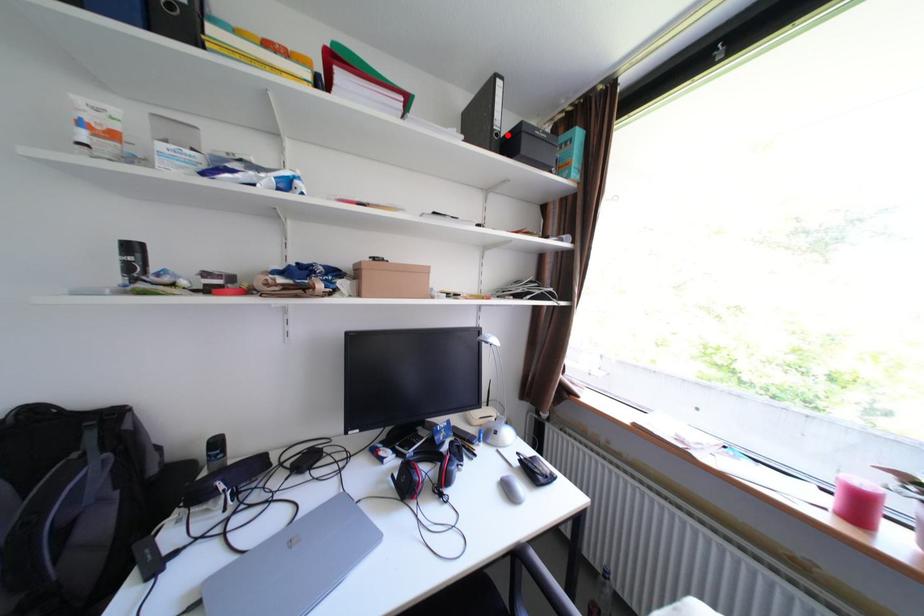
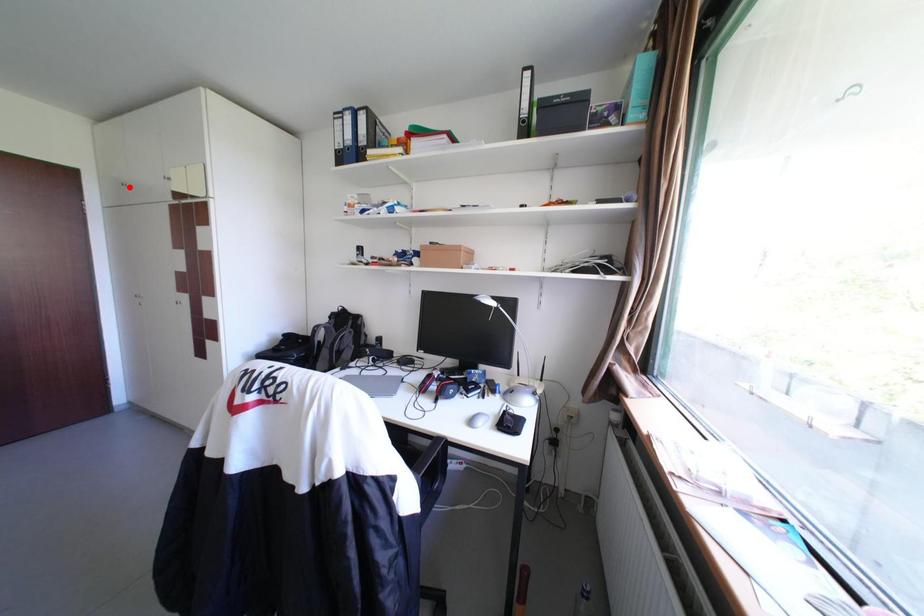
I am providing you with two images of the same scene from different viewpoints. A red point is marked on the first image and another point is marked on the second image. Are the points marked in image1 and image2 representing the same 3D position?

No